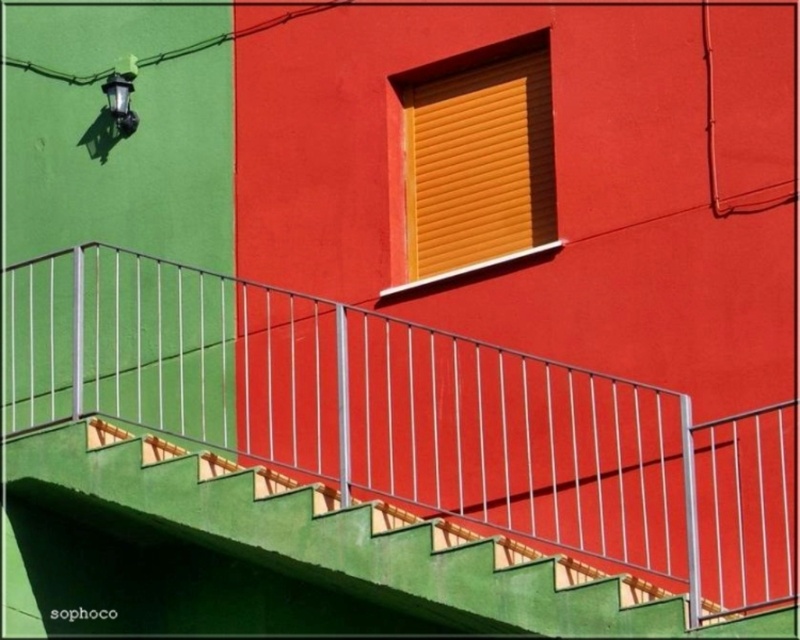
Question: Which object appears farthest from the camera in this image?

Choices:
 (A) metallic black lamp at upper left
 (B) metallic silver railing at center

Answer: (A)

Question: Is orange matte shutter at upper center to the right of metallic black lamp at upper left from the viewer's perspective?

Choices:
 (A) yes
 (B) no

Answer: (A)

Question: Is metallic silver railing at center thinner than orange matte shutter at upper center?

Choices:
 (A) no
 (B) yes

Answer: (A)

Question: Estimate the real-world distances between objects in this image. Which object is closer to the metallic silver railing at center?

Choices:
 (A) metallic black lamp at upper left
 (B) orange matte shutter at upper center

Answer: (B)

Question: Which point is farther from the camera taking this photo?

Choices:
 (A) (110, 408)
 (B) (429, 77)

Answer: (A)

Question: Is orange matte shutter at upper center smaller than metallic black lamp at upper left?

Choices:
 (A) no
 (B) yes

Answer: (A)